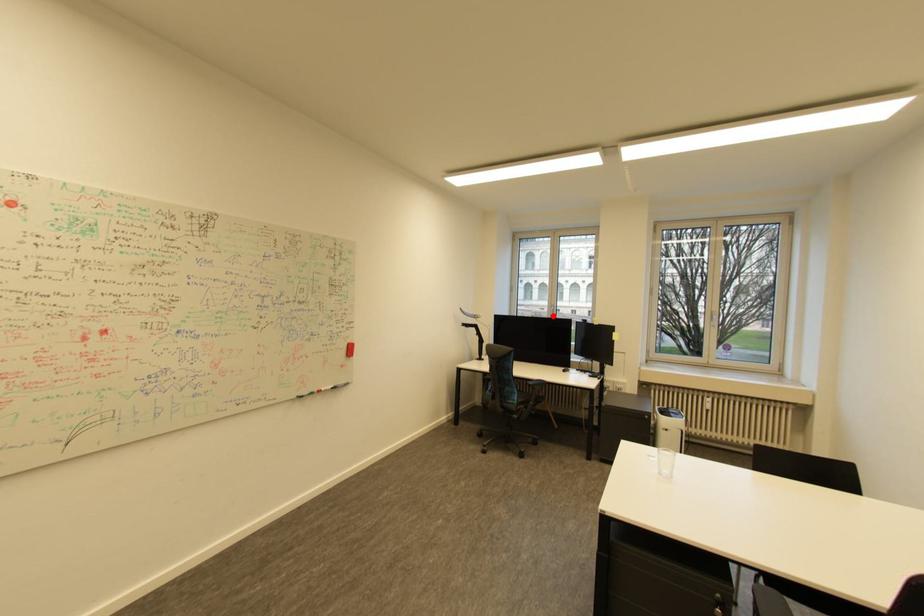
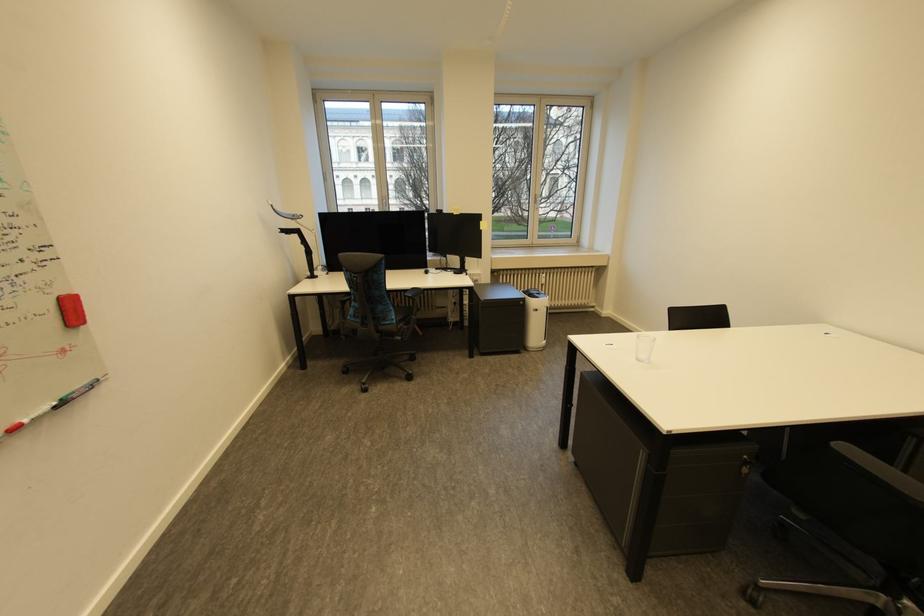
Locate, in the second image, the point that corresponds to the highlighted location in the first image.

(383, 209)